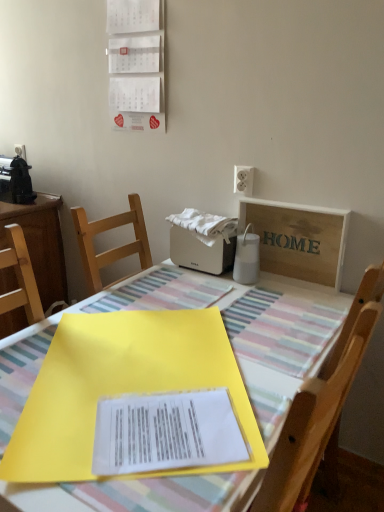
Question: Is white cotton towel at center bigger than yellow plastic folder at center?

Choices:
 (A) yes
 (B) no

Answer: (B)

Question: From the image's perspective, is white cotton towel at center beneath yellow plastic folder at center?

Choices:
 (A) yes
 (B) no

Answer: (B)

Question: Considering the relative sizes of white cotton towel at center and yellow plastic folder at center in the image provided, is white cotton towel at center smaller than yellow plastic folder at center?

Choices:
 (A) yes
 (B) no

Answer: (A)

Question: Is the position of white cotton towel at center more distant than that of yellow plastic folder at center?

Choices:
 (A) no
 (B) yes

Answer: (B)

Question: Is white cotton towel at center closer to the viewer compared to yellow plastic folder at center?

Choices:
 (A) yes
 (B) no

Answer: (B)

Question: Looking at the image, does white plastic toaster at center, which ranks as the second appliance in back-to-front order, seem bigger or smaller compared to wooden chair at center?

Choices:
 (A) big
 (B) small

Answer: (B)

Question: Considering the positions of point (226, 247) and point (311, 389), is point (226, 247) closer or farther from the camera than point (311, 389)?

Choices:
 (A) farther
 (B) closer

Answer: (A)

Question: Considering their positions, is white plastic toaster at center, marked as the first appliance in a bottom-to-top arrangement, located in front of or behind wooden chair at center?

Choices:
 (A) behind
 (B) front

Answer: (A)

Question: Is white plastic toaster at center, marked as the first appliance in a bottom-to-top arrangement, taller or shorter than wooden chair at center?

Choices:
 (A) tall
 (B) short

Answer: (B)

Question: Would you say yellow paper at center is to the left or to the right of yellow plastic folder at center in the picture?

Choices:
 (A) left
 (B) right

Answer: (A)

Question: Looking at their shapes, would you say yellow paper at center is wider or thinner than yellow plastic folder at center?

Choices:
 (A) thin
 (B) wide

Answer: (A)

Question: Looking at the image, does yellow paper at center seem bigger or smaller compared to yellow plastic folder at center?

Choices:
 (A) small
 (B) big

Answer: (A)

Question: Considering the positions of yellow paper at center and yellow plastic folder at center in the image, is yellow paper at center taller or shorter than yellow plastic folder at center?

Choices:
 (A) tall
 (B) short

Answer: (B)

Question: From the image's perspective, relative to wooden sign at upper right, is black plastic toaster at left, marked as the 2th appliance in a front-to-back arrangement, above or below?

Choices:
 (A) below
 (B) above

Answer: (B)

Question: Would you say black plastic toaster at left, which appears as the 1th appliance when viewed from the left, is to the left or to the right of wooden sign at upper right in the picture?

Choices:
 (A) right
 (B) left

Answer: (B)